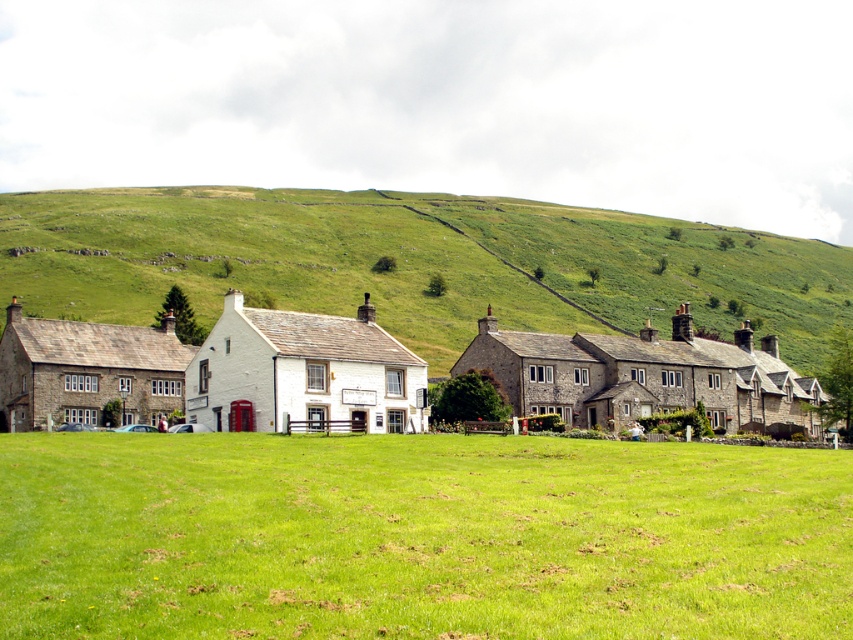
Is green grass at center thinner than stone houses at center?

Correct, green grass at center's width is less than stone houses at center's.

At what (x,y) coordinates should I click in order to perform the action: click on green grass at center. Please return your answer as a coordinate pair (x, y). Looking at the image, I should click on (419, 538).

What are the coordinates of `green grass at center` in the screenshot? It's located at (419, 538).

Is point (421, 310) more distant than point (715, 376)?

Yes.

Which is in front, point (230, 248) or point (0, 376)?

Positioned in front is point (0, 376).

Which is behind, point (695, 225) or point (508, 384)?

The point (695, 225) is more distant.

At what (x,y) coordinates should I click in order to perform the action: click on green grassy hillside at center. Please return your answer as a coordinate pair (x, y). Image resolution: width=853 pixels, height=640 pixels. Looking at the image, I should click on (410, 262).

Looking at this image, measure the distance between point (47, 598) and camera.

A distance of 91.82 feet exists between point (47, 598) and camera.

Which is below, green grass at center or green grassy hillside at center?

Positioned lower is green grass at center.

Is point (598, 525) behind point (434, 339)?

No, (598, 525) is in front of (434, 339).

At what (x,y) coordinates should I click in order to perform the action: click on green grass at center. Please return your answer as a coordinate pair (x, y). The height and width of the screenshot is (640, 853). Looking at the image, I should click on (419, 538).